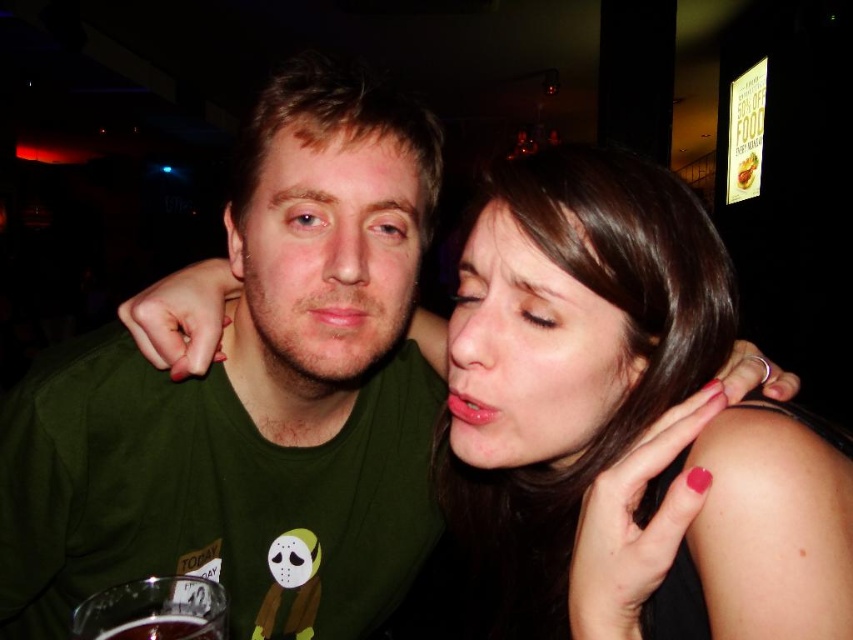
Between smooth skin at center and dark glass at lower left, which one has less height?

dark glass at lower left is shorter.

Is smooth skin at center positioned behind dark glass at lower left?

Yes, smooth skin at center is behind dark glass at lower left.

Locate an element on the screen. smooth skin at center is located at coordinates (625, 420).

Where is `smooth skin at center`? smooth skin at center is located at coordinates (625, 420).